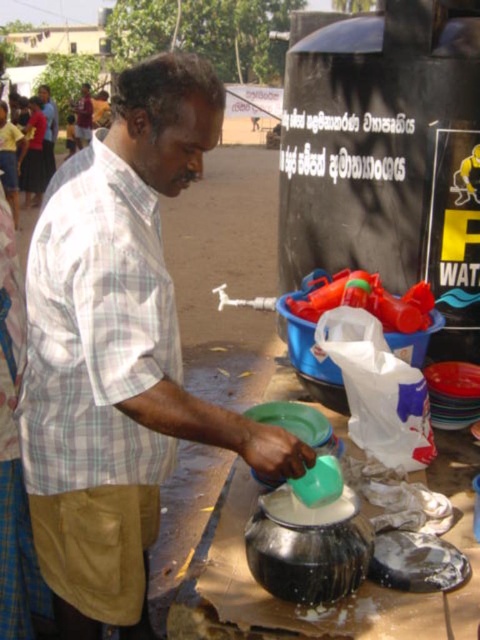
You are standing at the water distribution point and want to pick up an item from the table. If you first reach for the item located at point (58, 554) and then the item at point (92, 116), which item will require you to stretch your arm further?

The item at point (92, 116) will require you to stretch your arm further because it is farther from the viewer compared to the item at point (58, 554).

You are a photographer trying to capture the man pouring water. Which part of his clothing is more visible to you, the plaid cotton shirt at center or the matte white shirt at center?

The plaid cotton shirt at center is closer to the viewer than the matte white shirt at center, so the plaid cotton shirt at center is more visible.